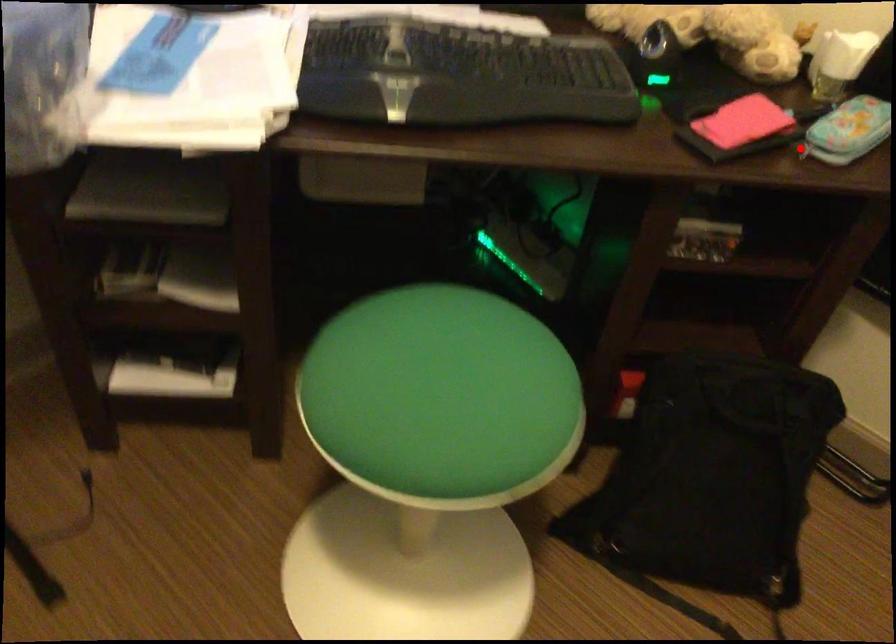
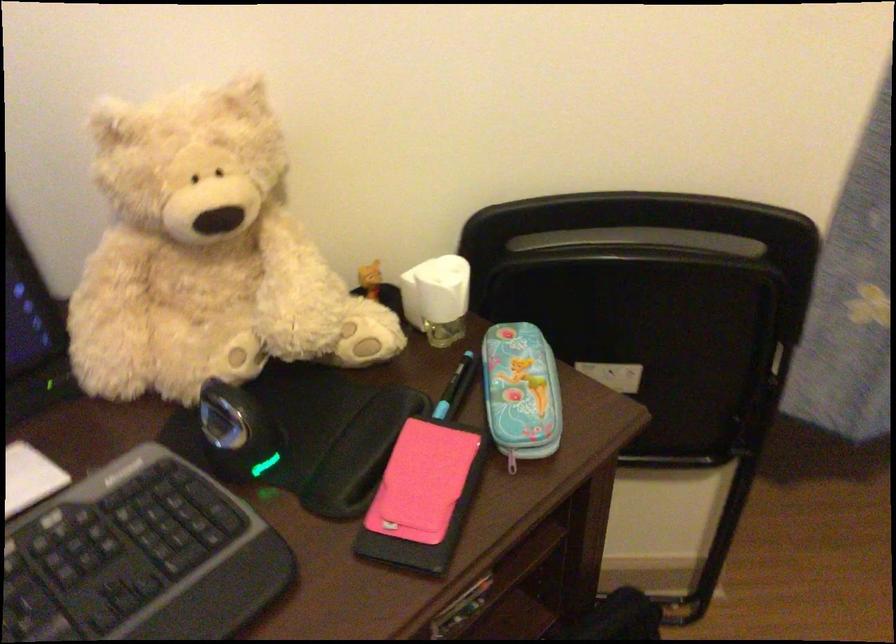
Question: I am providing you with two images of the same scene from different viewpoints. Given a red point in image1, look at the same physical point in image2. Is it:

Choices:
 (A) Closer to the viewpoint
 (B) Farther from the viewpoint

Answer: (A)